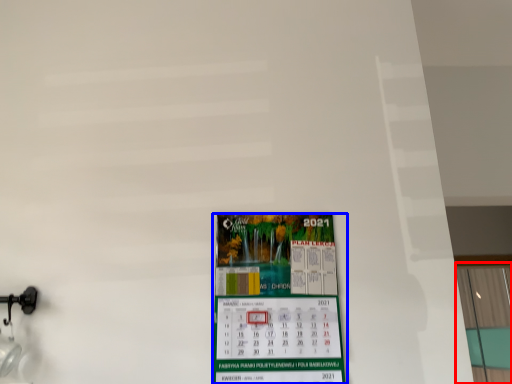
Question: Which of the following is the closest to the observer, window (highlighted by a red box) or poster (highlighted by a blue box)?

Choices:
 (A) window
 (B) poster

Answer: (B)